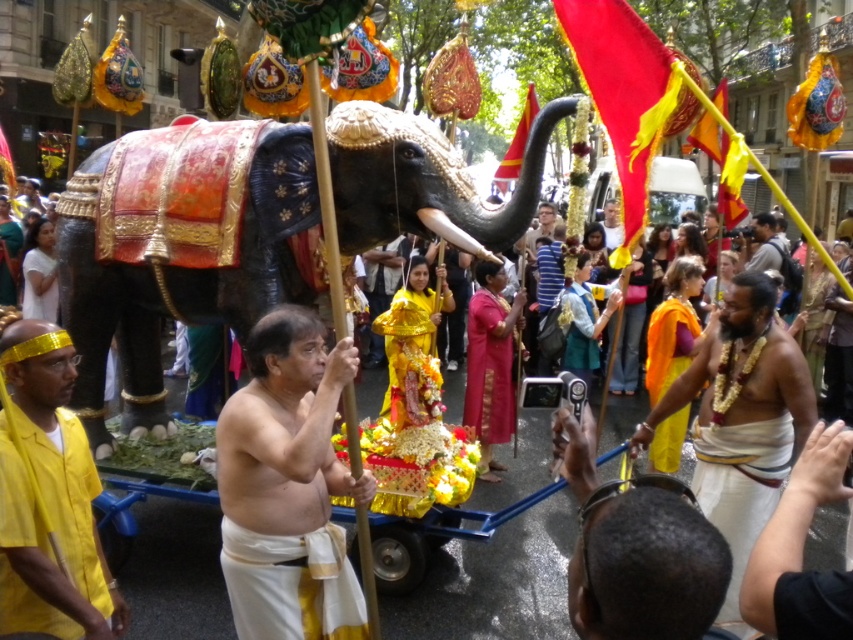
Who is positioned more to the left, gold/yellow fabric at center or light brown wooden stick at center?

Positioned to the left is gold/yellow fabric at center.

Which is more to the right, gold/yellow fabric at center or light brown wooden stick at center?

light brown wooden stick at center is more to the right.

Which is behind, point (408, 387) or point (534, 237)?

Point (534, 237)

At what (x,y) coordinates should I click in order to perform the action: click on gold/yellow fabric at center. Please return your answer as a coordinate pair (x, y). Image resolution: width=853 pixels, height=640 pixels. Looking at the image, I should click on (410, 358).

Which is in front, point (35, 442) or point (764, 481)?

Point (35, 442) is more forward.

Does yellow fabric shirt at left have a greater height compared to white silk dhoti at lower right?

Yes.

Between point (108, 618) and point (779, 440), which one is positioned in front?

Point (108, 618)

At what (x,y) coordinates should I click in order to perform the action: click on yellow fabric shirt at left. Please return your answer as a coordinate pair (x, y). Looking at the image, I should click on (49, 497).

From the picture: Between white cloth at center and orange silk sari at right, which one is positioned lower?

white cloth at center

Who is higher up, white cloth at center or orange silk sari at right?

orange silk sari at right

Where is `white cloth at center`? white cloth at center is located at coordinates (291, 584).